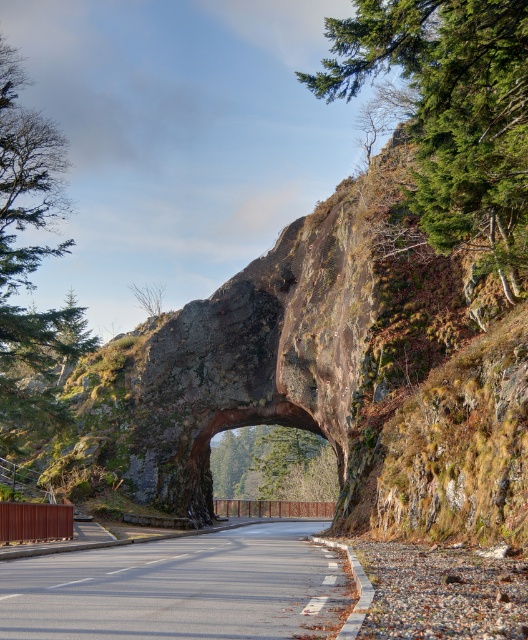
Question: Considering the real-world distances, which object is closest to the green leafy tree at center?

Choices:
 (A) green rough rock at upper right
 (B) asphalt road at center

Answer: (A)

Question: Does green textured tree at upper left have a larger size compared to green leafy tree at center?

Choices:
 (A) yes
 (B) no

Answer: (B)

Question: Can you confirm if asphalt road at center is positioned above green leafy tree at center?

Choices:
 (A) no
 (B) yes

Answer: (B)

Question: Among these points, which one is farthest from the camera?

Choices:
 (A) (268, 484)
 (B) (31, 419)

Answer: (A)

Question: Considering the real-world distances, which object is farthest from the green leafy tree at center?

Choices:
 (A) asphalt road at center
 (B) green textured tree at upper left

Answer: (A)

Question: Does green textured tree at upper left have a greater width compared to green leafy tree at center?

Choices:
 (A) yes
 (B) no

Answer: (B)